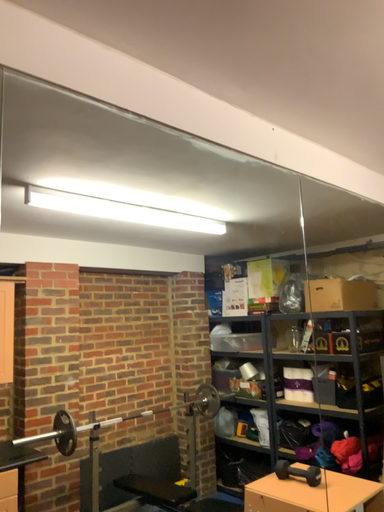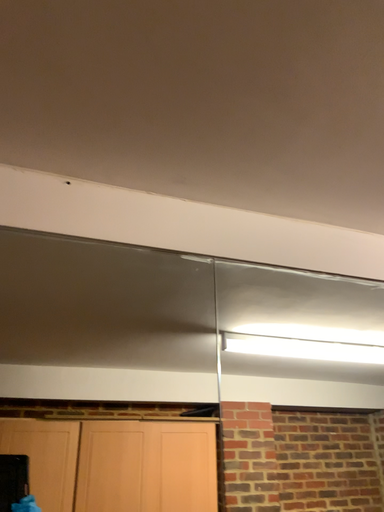
Question: How did the camera likely rotate when shooting the video?

Choices:
 (A) rotated upward
 (B) rotated downward

Answer: (A)